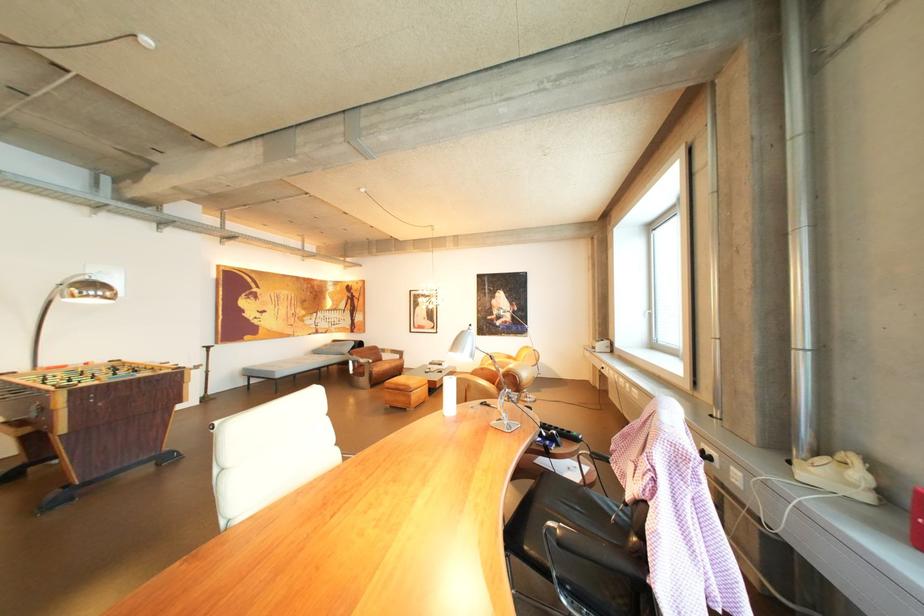
Which object does [406,391] point to?

It refers to a brown leather ottoman.